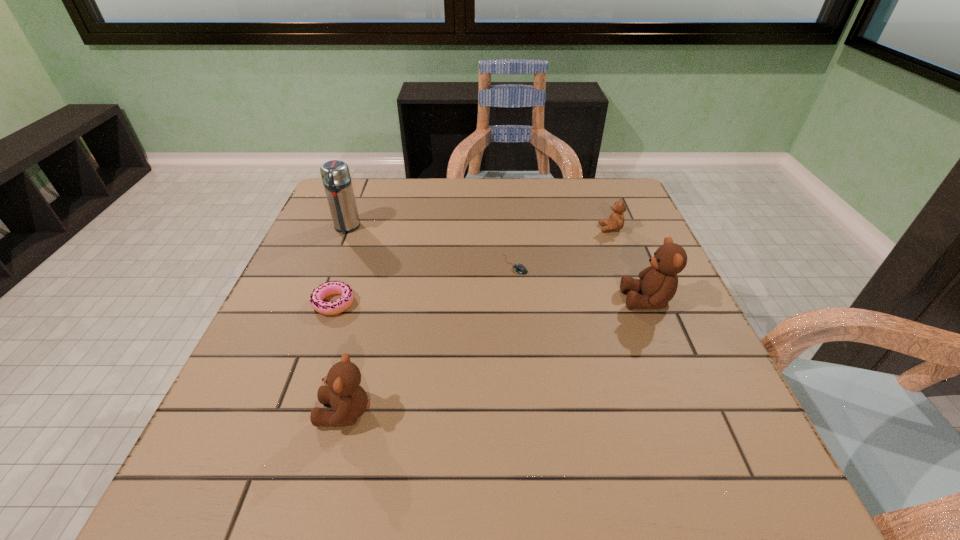
This screenshot has width=960, height=540. Identify the location of free space that satisfies the following two spatial constraints: 1. with a handle on the side of the doughnut; 2. on the right side of the tallest object. (317, 303).

Where is `blank area in the image that satisfies the following two spatial constraints: 1. with a handle on the side of the doughnut; 2. on the right side of the tallest object`? Image resolution: width=960 pixels, height=540 pixels. blank area in the image that satisfies the following two spatial constraints: 1. with a handle on the side of the doughnut; 2. on the right side of the tallest object is located at coordinates (317, 303).